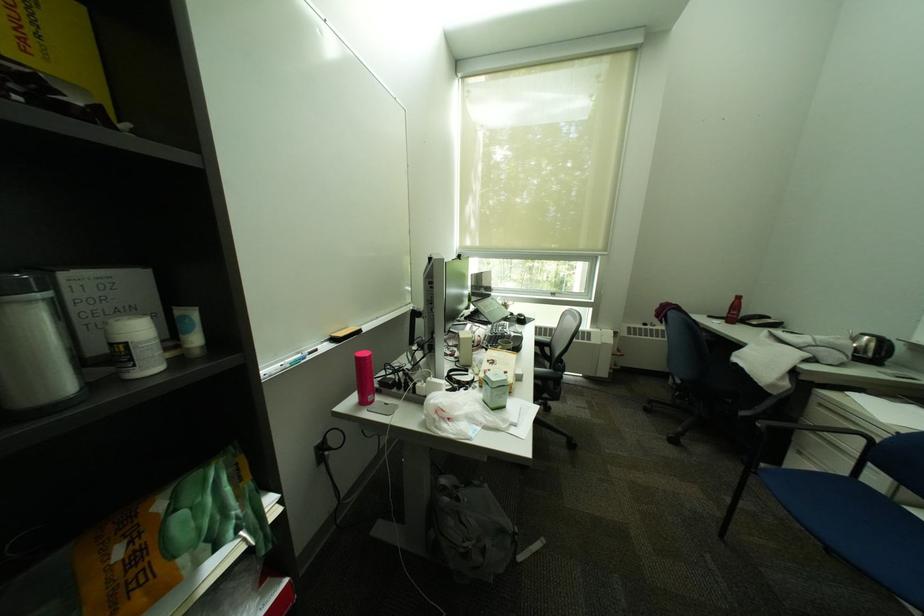
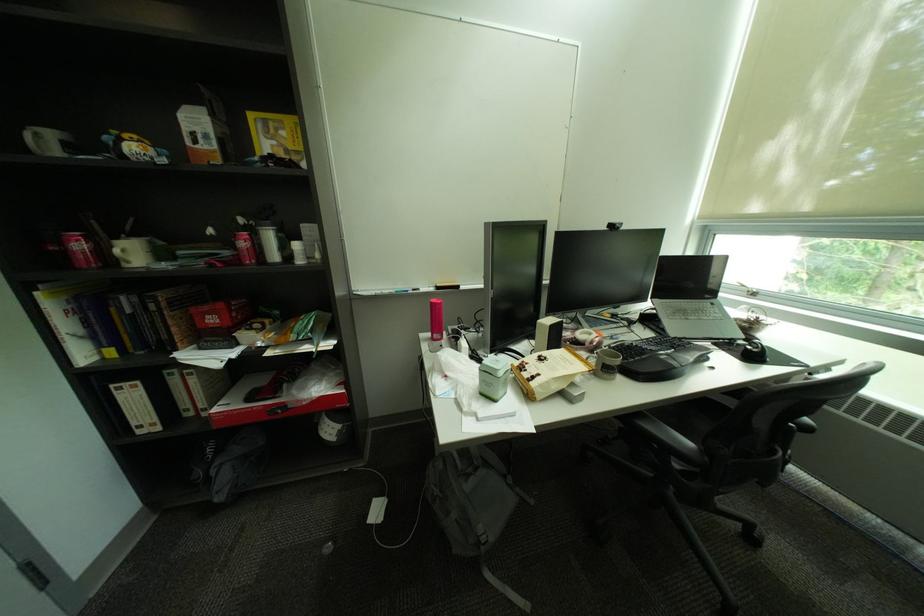
Find the pixel in the second image that matches [476,543] in the first image.

(446, 487)